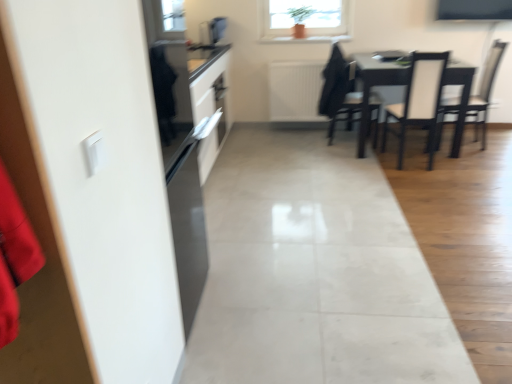
Question: Does white textured radiator at center have a greater height compared to white leather chair at center, which is the second chair from left to right?

Choices:
 (A) no
 (B) yes

Answer: (A)

Question: Is white textured radiator at center facing away from white leather chair at center, which is the second chair from left to right?

Choices:
 (A) no
 (B) yes

Answer: (A)

Question: Could you tell me if white textured radiator at center is facing white leather chair at center, which is the second chair from left to right?

Choices:
 (A) yes
 (B) no

Answer: (B)

Question: Would you say white textured radiator at center is outside white leather chair at center, which is the second chair from left to right?

Choices:
 (A) yes
 (B) no

Answer: (A)

Question: From the image's perspective, does white textured radiator at center appear lower than white leather chair at center, which is the second chair from left to right?

Choices:
 (A) yes
 (B) no

Answer: (B)

Question: Is white leather chair at center, the second chair positioned from the right, inside or outside of satin black microwave at upper center?

Choices:
 (A) outside
 (B) inside

Answer: (A)

Question: From the image's perspective, is white leather chair at center, which is the second chair from left to right, positioned above or below satin black microwave at upper center?

Choices:
 (A) above
 (B) below

Answer: (B)

Question: In terms of size, does white leather chair at center, the second chair positioned from the right, appear bigger or smaller than satin black microwave at upper center?

Choices:
 (A) small
 (B) big

Answer: (B)

Question: Considering the positions of white leather chair at center, the second chair positioned from the right, and satin black microwave at upper center in the image, is white leather chair at center, the second chair positioned from the right, taller or shorter than satin black microwave at upper center?

Choices:
 (A) short
 (B) tall

Answer: (B)

Question: Considering the positions of dark wood chair at center, arranged as the 1th chair when viewed from the left, and white leather chair at right, the 1th chair when ordered from right to left, in the image, is dark wood chair at center, arranged as the 1th chair when viewed from the left, bigger or smaller than white leather chair at right, the 1th chair when ordered from right to left,?

Choices:
 (A) big
 (B) small

Answer: (B)

Question: Choose the correct answer: Is dark wood chair at center, arranged as the third chair when viewed from the right, inside white leather chair at right, the third chair from the left, or outside it?

Choices:
 (A) inside
 (B) outside

Answer: (B)

Question: In the image, is dark wood chair at center, arranged as the third chair when viewed from the right, positioned in front of or behind white leather chair at right, the third chair from the left?

Choices:
 (A) behind
 (B) front

Answer: (A)

Question: Would you say dark wood chair at center, arranged as the third chair when viewed from the right, is to the left or to the right of white leather chair at right, the 1th chair when ordered from right to left, in the picture?

Choices:
 (A) left
 (B) right

Answer: (A)

Question: From the image's perspective, is white leather chair at right, the third chair from the left, located above or below satin black microwave at upper center?

Choices:
 (A) below
 (B) above

Answer: (A)

Question: In terms of height, does white leather chair at right, the 1th chair when ordered from right to left, look taller or shorter compared to satin black microwave at upper center?

Choices:
 (A) tall
 (B) short

Answer: (A)